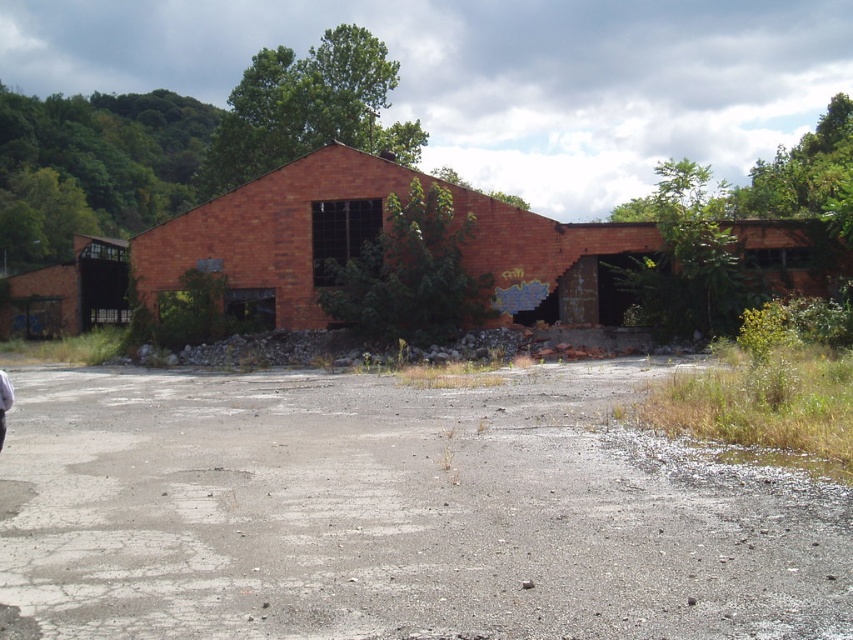
You are a drone operator trying to land your drone on the gray asphalt at center. The drone has a GPS coordinate system where the bottom left corner of the image is the origin point. The coordinates are given as a percentage of the image width and height. What are the coordinates where you should aim to land the drone?

The gray asphalt at center is located at coordinates point [393,515], so you should aim for those coordinates to land the drone.

You are standing at the entrance of the abandoned brick building and see two points marked in the image. Which point, point (386,214) or point (30,333), is closer to you?

Point (386,214) is closer to you than point (30,333).